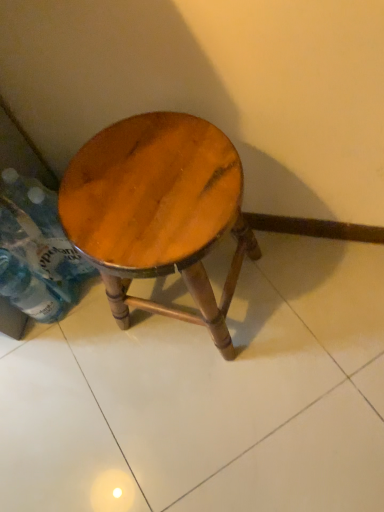
Question: From the image's perspective, is wooden stool at center positioned above or below clear plastic bottle at lower left, the 1th bottle when ordered from bottom to top?

Choices:
 (A) below
 (B) above

Answer: (B)

Question: Considering the relative positions of wooden stool at center and clear plastic bottle at lower left, the 1th bottle when ordered from bottom to top, in the image provided, is wooden stool at center to the left or to the right of clear plastic bottle at lower left, the 1th bottle when ordered from bottom to top,?

Choices:
 (A) left
 (B) right

Answer: (B)

Question: Which is farther from the wooden stool at center?

Choices:
 (A) clear plastic bottle at lower left, the second bottle positioned from the top
 (B) translucent plastic bottle at lower left, placed as the 1th bottle when sorted from top to bottom

Answer: (A)

Question: Which object is positioned farthest from the clear plastic bottle at lower left, the 1th bottle when ordered from bottom to top?

Choices:
 (A) translucent plastic bottle at lower left, which is counted as the second bottle, starting from the bottom
 (B) wooden stool at center

Answer: (B)